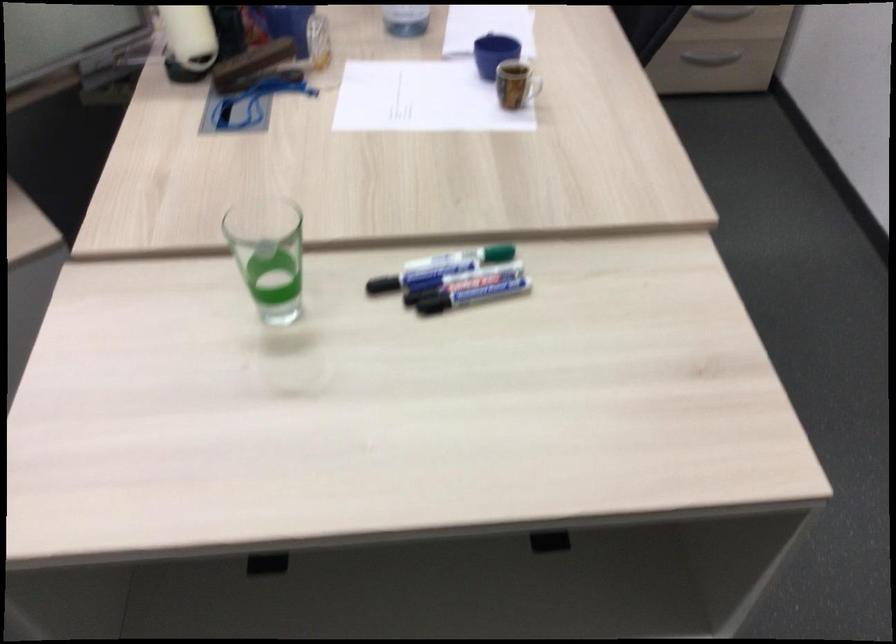
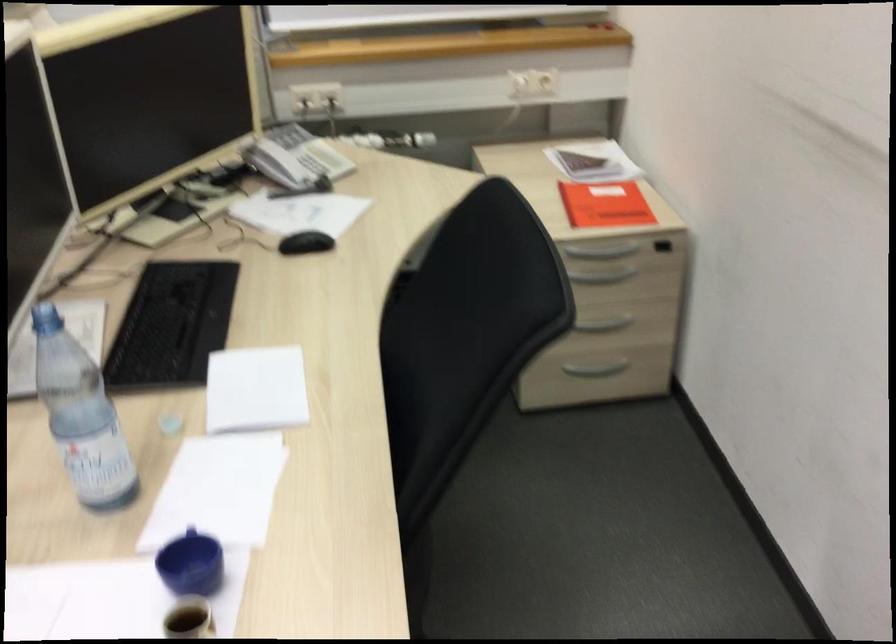
What movement of the cameraman would produce the second image?

The cameraman moved toward right, forward.